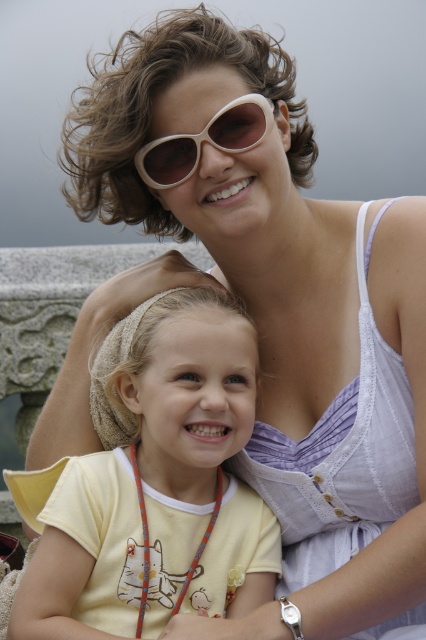
Question: Is yellow cotton shirt at center smaller than beige plastic sunglasses at upper center?

Choices:
 (A) yes
 (B) no

Answer: (B)

Question: Which of the following is the farthest from the observer?

Choices:
 (A) (250, 144)
 (B) (158, 348)

Answer: (A)

Question: In this image, where is yellow cotton shirt at center located relative to beige plastic sunglasses at upper center?

Choices:
 (A) above
 (B) below

Answer: (B)

Question: Does yellow cotton shirt at center appear on the left side of beige plastic sunglasses at upper center?

Choices:
 (A) no
 (B) yes

Answer: (B)